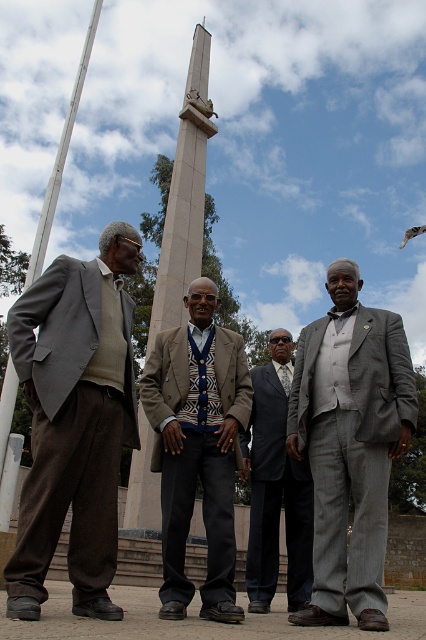
You are a photographer positioned at the origin point of the coordinate system. The monument is at the center of the image. Where is the matte gray suit at left relative to the monument?

The matte gray suit at left is located at point (74, 420) relative to the monument, which means it is positioned to the left and slightly below the monument in the image.

You are a photographer at the event and need to position yourself so that the gray suit at center and the smooth stone obelisk at center are both visible in your shot. Based on their positions, which side of the obelisk should you stand on to ensure both are in frame?

You should stand to the left side of the smooth stone obelisk at center because the gray suit at center is positioned to the right of it, so placing yourself on the left will allow both the obelisk and the person in the gray suit at center to be captured in the photograph.

You are a photographer at the event and need to arrange the matte gray suit at left and the gray suit at center so that both are visible in the photo. Since the monument is in the background, which of the two men should you position closer to the camera to ensure their full height is captured without being blocked by the monument?

The matte gray suit at left is taller than the gray suit at center, so you should position the matte gray suit at left closer to the camera to ensure their full height is visible without being blocked by the monument.